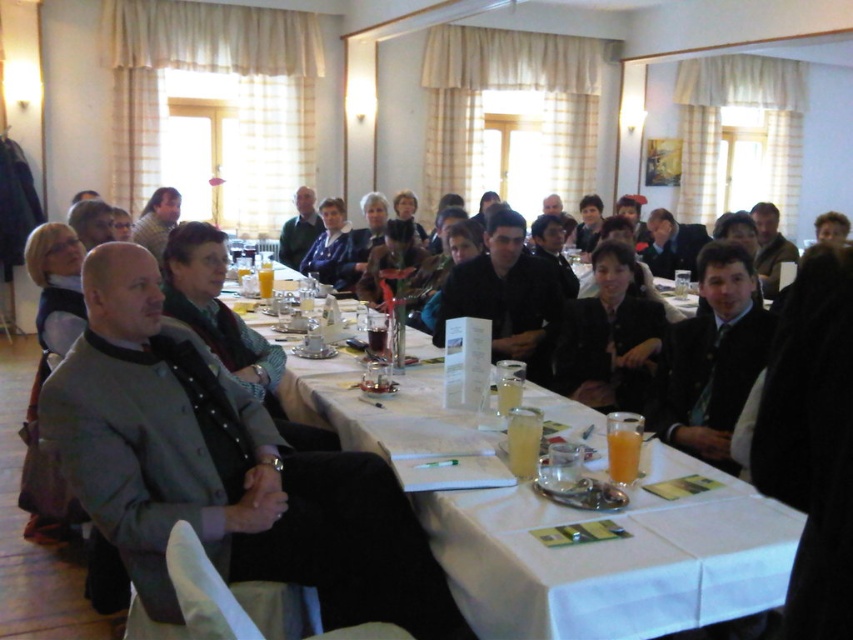
You are sitting at the white cloth table at center and want to pick up the green textured sweater at upper center. Can you reach it without leaving your seat?

The white cloth table at center is closer to the viewer than the green textured sweater at upper center, so the sweater is farther away. You might not be able to reach it without moving from your seat.

You are standing at the entrance of the conference room and want to walk directly to the white cloth table at center. According to the room layout, what coordinates should you aim for to reach it?

You should aim for the coordinates point (614, 557) to reach the white cloth table at center.